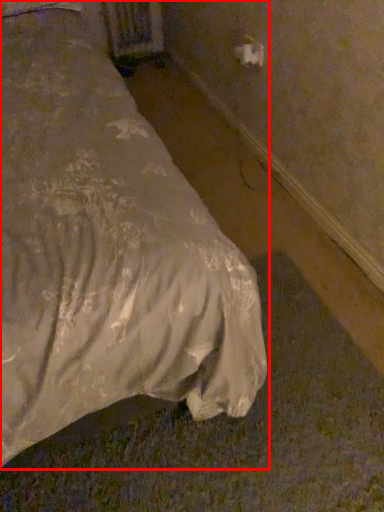
Question: Considering the relative positions of bed (annotated by the red box) and electric outlet in the image provided, where is bed (annotated by the red box) located with respect to the staircase?

Choices:
 (A) left
 (B) right

Answer: (A)